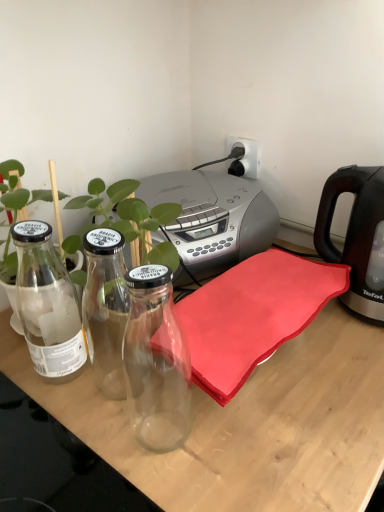
Question: From the image's perspective, is clear glass plant at center under black plastic kettle at right?

Choices:
 (A) no
 (B) yes

Answer: (B)

Question: Can you confirm if clear glass plant at center is positioned to the left of black plastic kettle at right?

Choices:
 (A) yes
 (B) no

Answer: (A)

Question: From the image's perspective, is clear glass plant at center on top of black plastic kettle at right?

Choices:
 (A) no
 (B) yes

Answer: (A)

Question: Can you confirm if clear glass plant at center is thinner than black plastic kettle at right?

Choices:
 (A) no
 (B) yes

Answer: (A)

Question: Is black plastic kettle at right inside clear glass plant at center?

Choices:
 (A) yes
 (B) no

Answer: (B)

Question: Considering the relative sizes of clear glass plant at center and black plastic kettle at right in the image provided, is clear glass plant at center wider than black plastic kettle at right?

Choices:
 (A) yes
 (B) no

Answer: (A)

Question: Is green leafy plant at left facing away from black plastic kettle at right?

Choices:
 (A) yes
 (B) no

Answer: (B)

Question: Is green leafy plant at left aimed at black plastic kettle at right?

Choices:
 (A) no
 (B) yes

Answer: (A)

Question: Is green leafy plant at left thinner than black plastic kettle at right?

Choices:
 (A) no
 (B) yes

Answer: (B)

Question: From a real-world perspective, is green leafy plant at left positioned over black plastic kettle at right based on gravity?

Choices:
 (A) no
 (B) yes

Answer: (B)

Question: Considering the relative sizes of green leafy plant at left and black plastic kettle at right in the image provided, is green leafy plant at left taller than black plastic kettle at right?

Choices:
 (A) no
 (B) yes

Answer: (B)

Question: Is there a large distance between green leafy plant at left and black plastic kettle at right?

Choices:
 (A) no
 (B) yes

Answer: (A)

Question: From the image's perspective, is white plastic electric outlet at upper center located beneath transparent glass bottles at left?

Choices:
 (A) yes
 (B) no

Answer: (B)